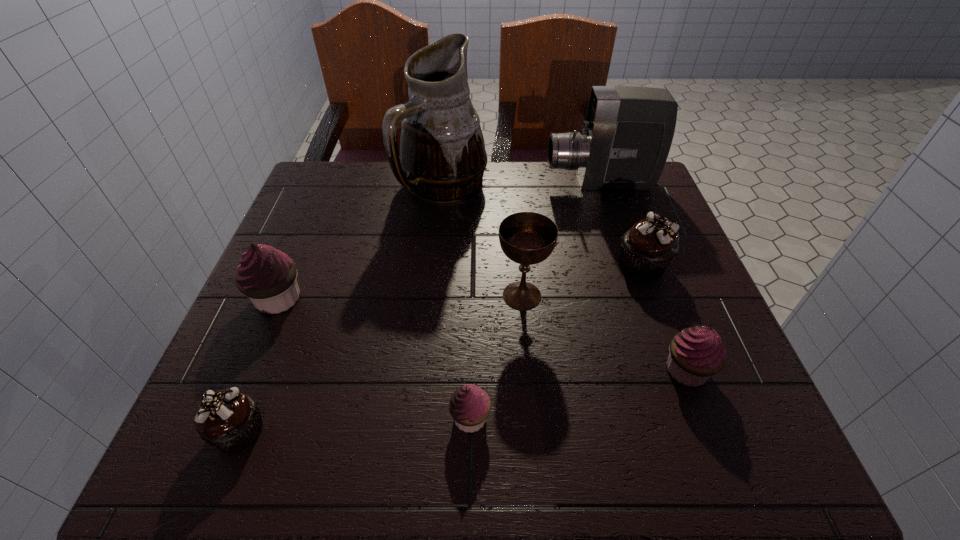
The image size is (960, 540). I want to click on vacant area in the image that satisfies the following two spatial constraints: 1. at the front of the camcorder, highlighting the lens; 2. from the spout of the brown pitcher, so click(x=601, y=187).

I want to click on free point that satisfies the following two spatial constraints: 1. on the back side of the nearer brown cupcake; 2. on the left side of the right brown cupcake, so click(x=304, y=265).